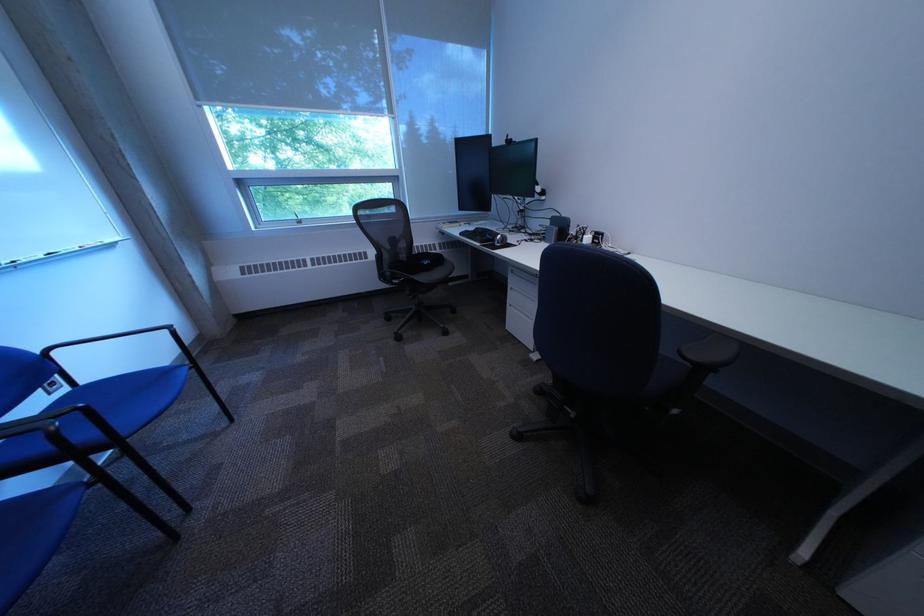
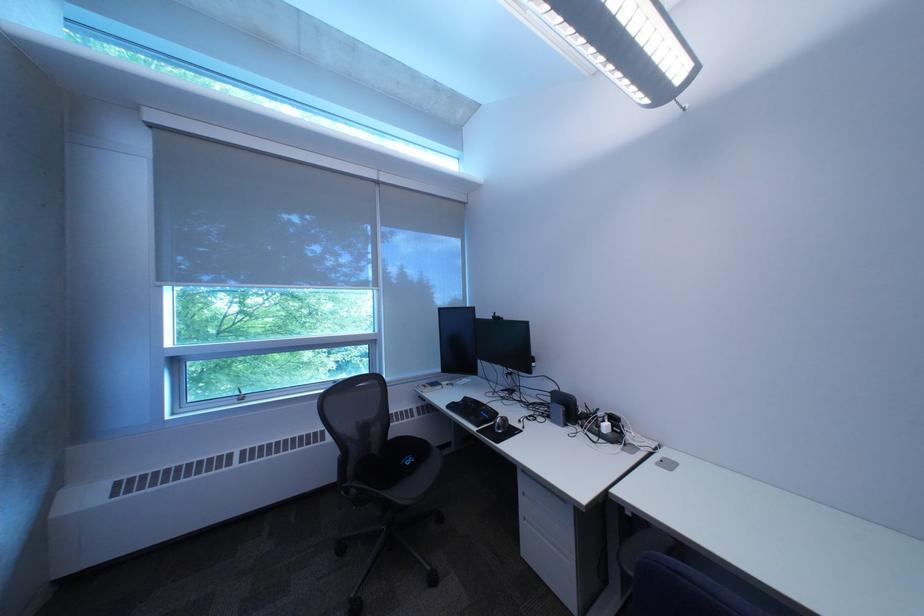
Locate, in the second image, the point that corresponds to the point at 523,330 in the first image.

(539, 556)